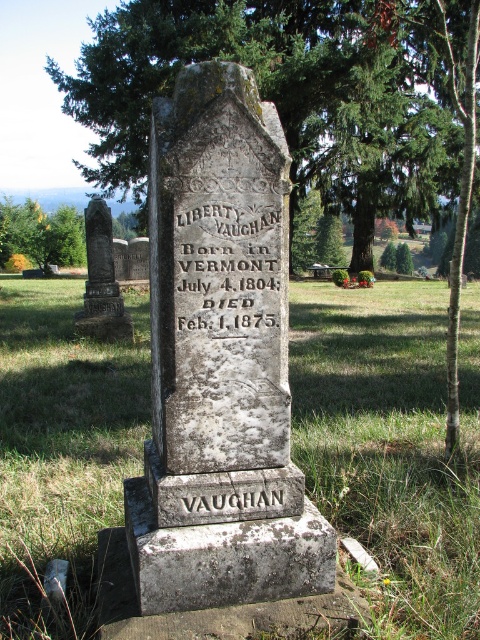
Between gray stone gravestone at center and green leafy tree at left, which one is positioned higher?

Positioned higher is green leafy tree at left.

In the scene shown: Is gray stone gravestone at center to the right of green leafy tree at left from the viewer's perspective?

Correct, you'll find gray stone gravestone at center to the right of green leafy tree at left.

You are a GUI agent. You are given a task and a screenshot of the screen. Output one action in this format:
    pyautogui.click(x=<x>, y=<y>)
    Task: Click on the gray stone gravestone at center
    The image size is (480, 640).
    Given the screenshot: What is the action you would take?
    pyautogui.click(x=219, y=355)

Which is behind, point (17, 248) or point (108, 260)?

The point (17, 248) is more distant.

Does green leafy tree at left come in front of rusty metal gravestone at left?

No, it is behind rusty metal gravestone at left.

Is point (67, 214) positioned behind point (108, 237)?

Yes, it is.

The height and width of the screenshot is (640, 480). In order to click on green leafy tree at left in this screenshot , I will do `click(41, 234)`.

Does green grass at center appear on the right side of gray stone gravestone at center?

Indeed, green grass at center is positioned on the right side of gray stone gravestone at center.

Consider the image. Does green grass at center have a lesser width compared to gray stone gravestone at center?

No.

Is point (393, 538) farther from viewer compared to point (149, 497)?

Yes, it is.

At what (x,y) coordinates should I click in order to perform the action: click on green grass at center. Please return your answer as a coordinate pair (x, y). Image resolution: width=480 pixels, height=640 pixels. Looking at the image, I should click on (393, 442).